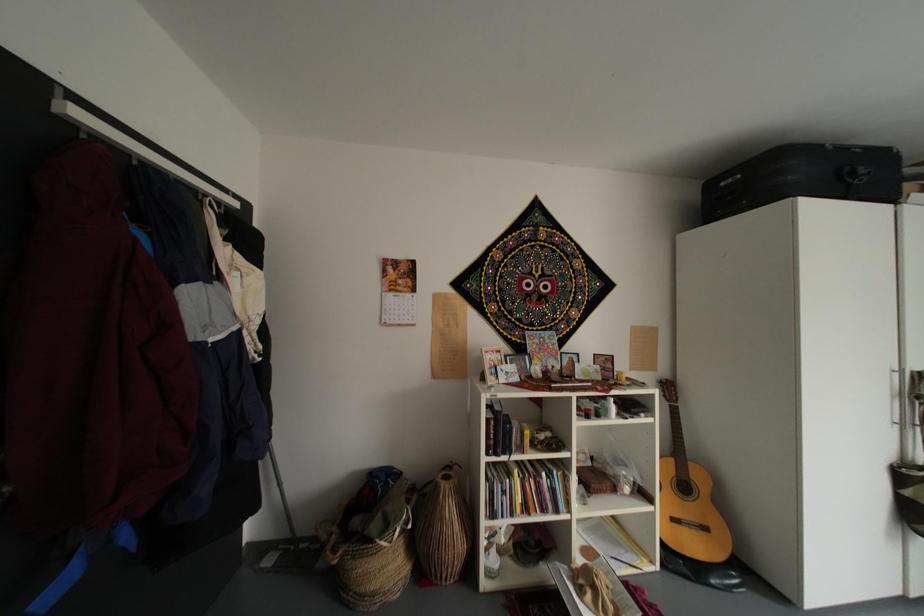
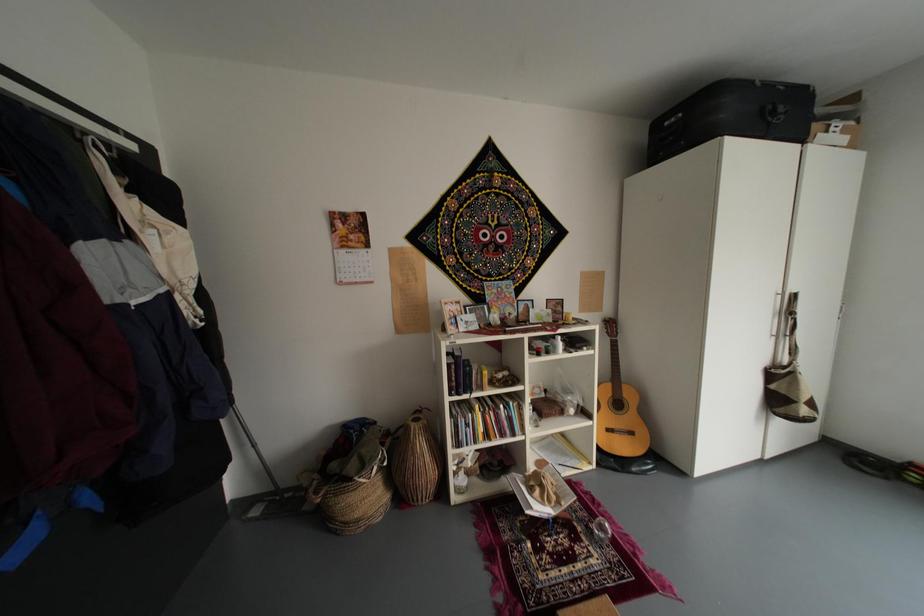
Question: How did the camera likely rotate?

Choices:
 (A) Left
 (B) Right
 (C) Up
 (D) Down

Answer: (D)